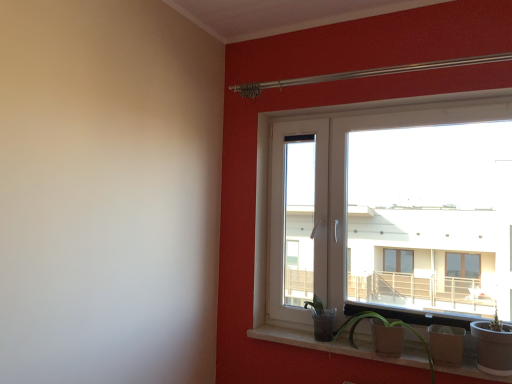
Identify the location of vacant area to the right of green matte vase at lower center. (349, 340).